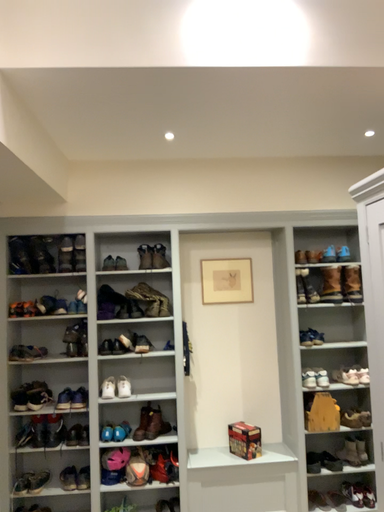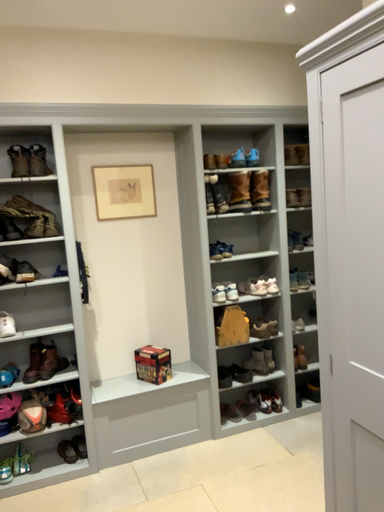
Question: Which way did the camera rotate in the video?

Choices:
 (A) rotated left
 (B) rotated right

Answer: (B)